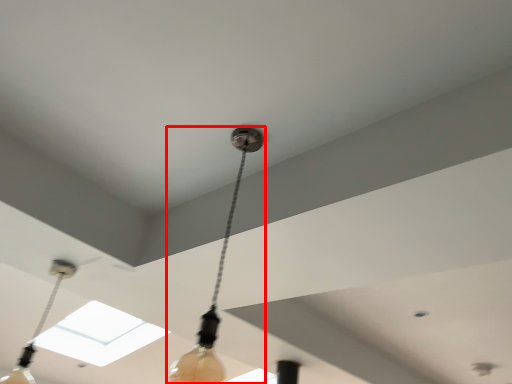
Question: From the image, what is the correct spatial relationship of lamp (annotated by the red box) in relation to lamp?

Choices:
 (A) right
 (B) left

Answer: (A)